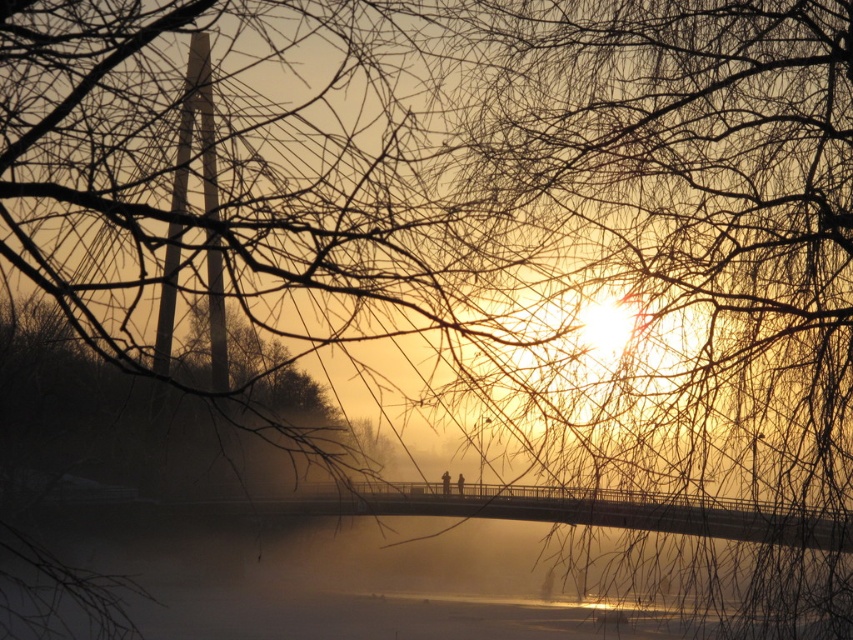
Looking at this image, you are an artist trying to paint the winter scene. You want to ensure the positioning of the translucent misty water at center and the brown matte tree at center aligns with the actual image. Based on the scene description, which object is positioned to the right of the other?

The translucent misty water at center is to the right of brown matte tree at center.

You are an artist planning to paint the winter scene. You need to decide which object to paint first based on their thickness. According to the scene description, which object should you paint first, the translucent misty water at center or the brown matte tree at center?

The translucent misty water at center is thinner than the brown matte tree at center, so you should paint the brown matte tree at center first as it has more thickness and forms the base layer.